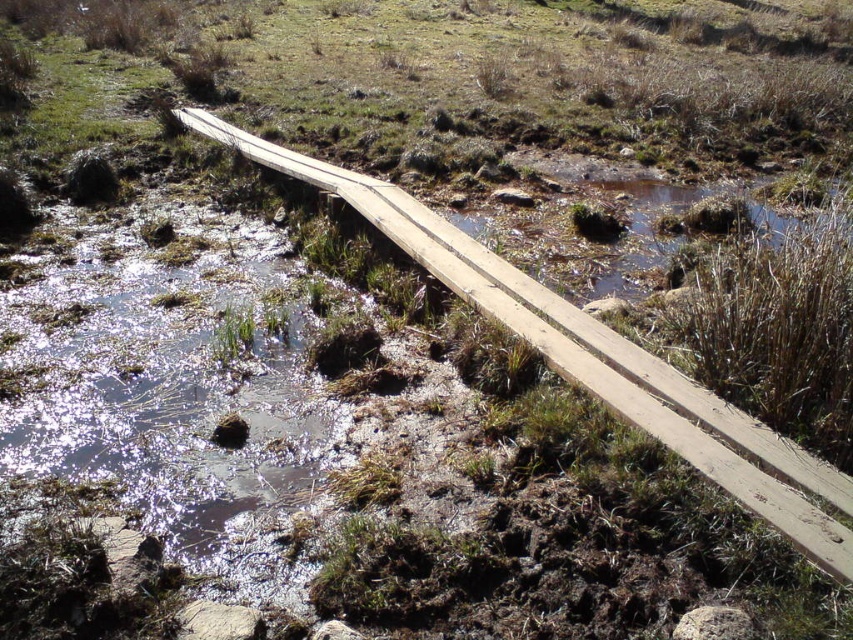
Looking at this image, who is shorter, shiny mud water at lower left or wooden bridge at center?

wooden bridge at center is shorter.

Is shiny mud water at lower left to the right of wooden bridge at center from the viewer's perspective?

Incorrect, shiny mud water at lower left is not on the right side of wooden bridge at center.

Is point (32, 401) farther from camera compared to point (708, 410)?

Yes, point (32, 401) is farther from viewer.

What are the coordinates of `shiny mud water at lower left` in the screenshot? It's located at (167, 378).